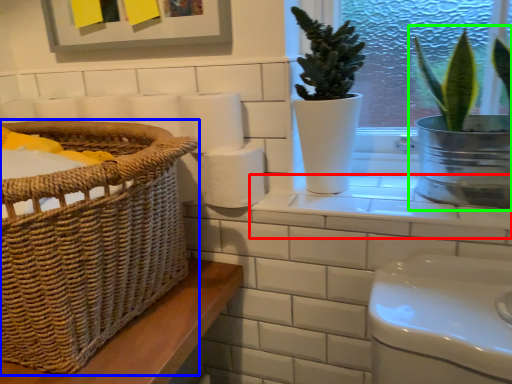
Question: Which object is the closest to the window sill (highlighted by a red box)? Choose among these: basket (highlighted by a blue box) or houseplant (highlighted by a green box).

Choices:
 (A) basket
 (B) houseplant

Answer: (B)